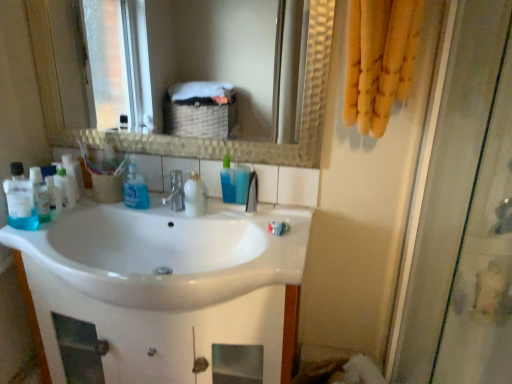
Question: Is transparent glass shower door at right positioned with its back to white glossy toothpaste at center?

Choices:
 (A) yes
 (B) no

Answer: (B)

Question: From a real-world perspective, is transparent glass shower door at right over white glossy toothpaste at center?

Choices:
 (A) no
 (B) yes

Answer: (A)

Question: Is transparent glass shower door at right located outside white glossy toothpaste at center?

Choices:
 (A) no
 (B) yes

Answer: (B)

Question: Is transparent glass shower door at right smaller than white glossy toothpaste at center?

Choices:
 (A) no
 (B) yes

Answer: (A)

Question: From the image's perspective, would you say transparent glass shower door at right is positioned over white glossy toothpaste at center?

Choices:
 (A) yes
 (B) no

Answer: (B)

Question: From the image's perspective, is satin nickel faucet at center, the second tap positioned from the left, positioned above or below white glossy toothpaste at center?

Choices:
 (A) above
 (B) below

Answer: (A)

Question: In the image, is satin nickel faucet at center, placed as the 1th tap when sorted from right to left, positioned in front of or behind white glossy toothpaste at center?

Choices:
 (A) front
 (B) behind

Answer: (B)

Question: From their relative heights in the image, would you say satin nickel faucet at center, the second tap positioned from the left, is taller or shorter than white glossy toothpaste at center?

Choices:
 (A) tall
 (B) short

Answer: (A)

Question: Considering the positions of point (253, 177) and point (280, 225), is point (253, 177) closer or farther from the camera than point (280, 225)?

Choices:
 (A) closer
 (B) farther

Answer: (B)

Question: From a real-world perspective, is translucent plastic mouthwash at left, the 2th mouthwash from the right, physically located above or below white glossy bottle at center, marked as the second cleaning product in a right-to-left arrangement?

Choices:
 (A) above
 (B) below

Answer: (A)

Question: Is point coord(15,165) closer or farther from the camera than point coord(205,205)?

Choices:
 (A) farther
 (B) closer

Answer: (B)

Question: Looking at the image, does translucent plastic mouthwash at left, which ranks as the 2th mouthwash in back-to-front order, seem bigger or smaller compared to white glossy bottle at center, marked as the second cleaning product in a right-to-left arrangement?

Choices:
 (A) big
 (B) small

Answer: (B)

Question: From the image's perspective, relative to white glossy bottle at center, marked as the second cleaning product in a right-to-left arrangement, is translucent plastic mouthwash at left, the first mouthwash from the left, above or below?

Choices:
 (A) below
 (B) above

Answer: (A)

Question: Is satin nickel faucet at center, arranged as the 2th tap when viewed from the right, to the left or to the right of white glossy bottle at center, which is the 3th cleaning product in left-to-right order, in the image?

Choices:
 (A) right
 (B) left

Answer: (B)

Question: In terms of height, does satin nickel faucet at center, arranged as the 2th tap when viewed from the right, look taller or shorter compared to white glossy bottle at center, marked as the second cleaning product in a right-to-left arrangement?

Choices:
 (A) tall
 (B) short

Answer: (B)